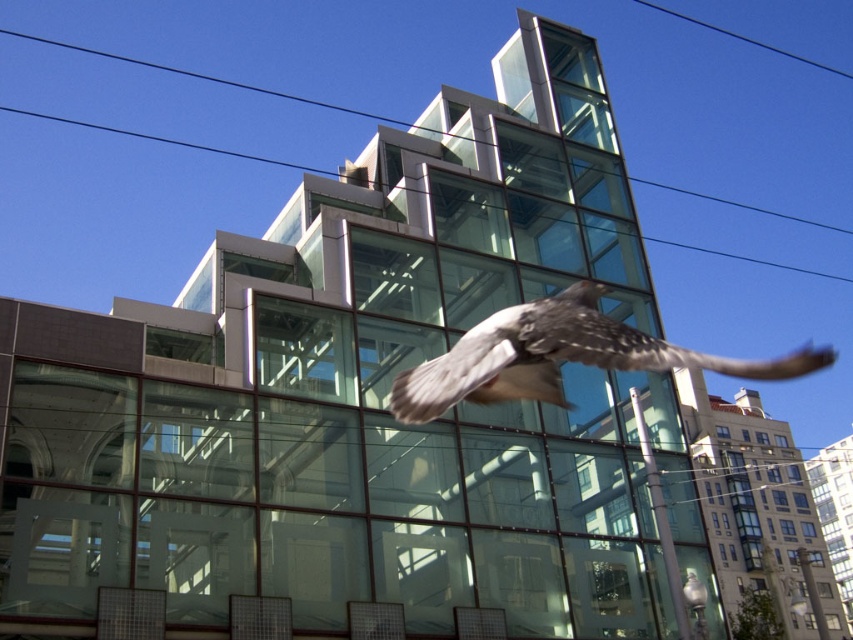
Who is lower down, speckled feathered bird at center or transparent glass power line at upper center?

Positioned lower is speckled feathered bird at center.

Does speckled feathered bird at center come behind transparent glass power line at upper center?

No, it is in front of transparent glass power line at upper center.

Where is `speckled feathered bird at center`? speckled feathered bird at center is located at coordinates (560, 356).

This screenshot has width=853, height=640. Identify the location of speckled feathered bird at center. coord(560,356).